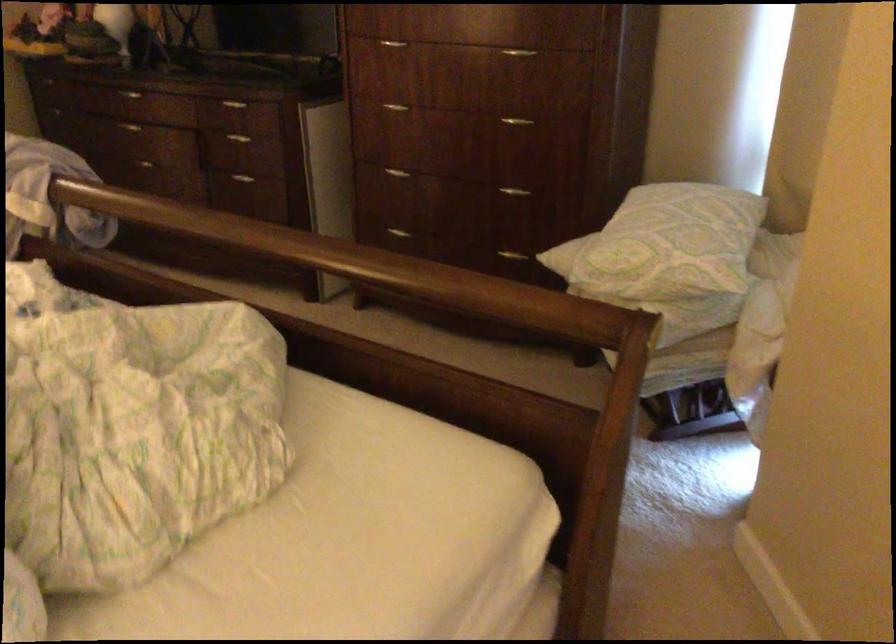
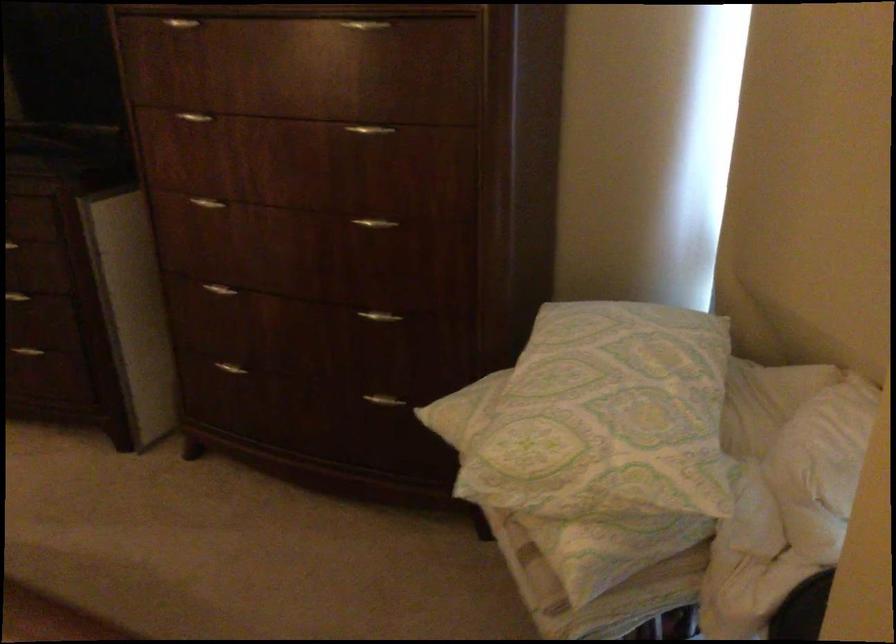
Question: What movement of the cameraman would produce the second image?

Choices:
 (A) Left
 (B) Right
 (C) Forward
 (D) Backward

Answer: (C)